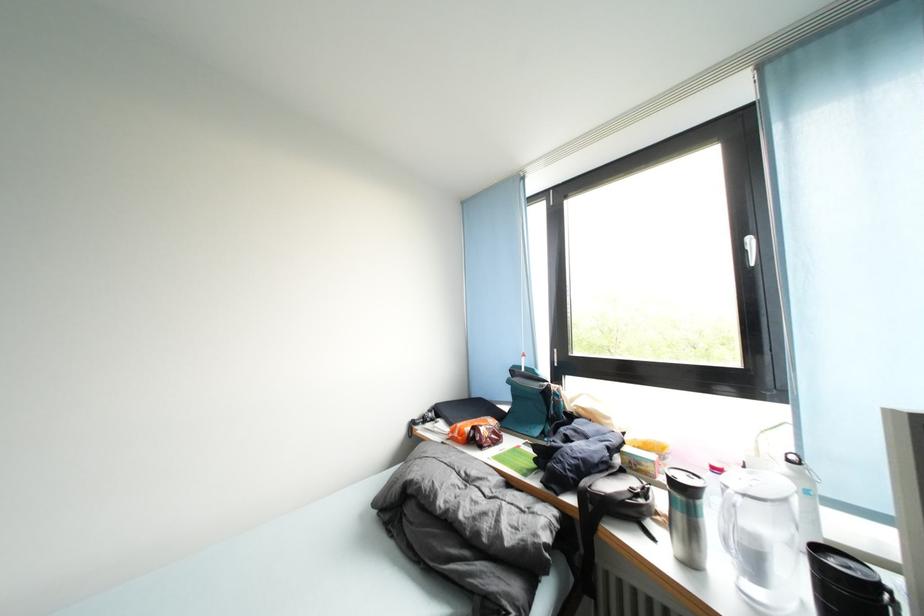
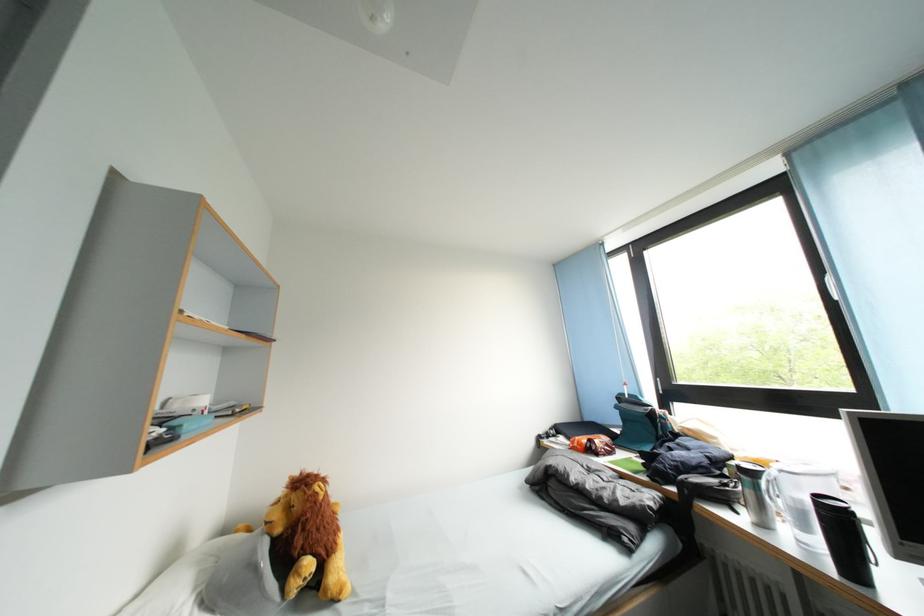
Question: The camera is either moving clockwise (left) or counter-clockwise (right) around the object. The first image is from the beginning of the video and the second image is from the end. Is the camera moving left or right when shooting the video?

Choices:
 (A) Left
 (B) Right

Answer: (B)